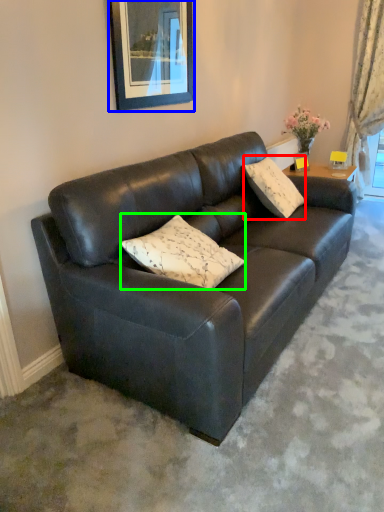
Question: Which object is the closest to the pillow (highlighted by a red box)? Choose among these: picture frame (highlighted by a blue box) or pillow (highlighted by a green box).

Choices:
 (A) picture frame
 (B) pillow

Answer: (A)